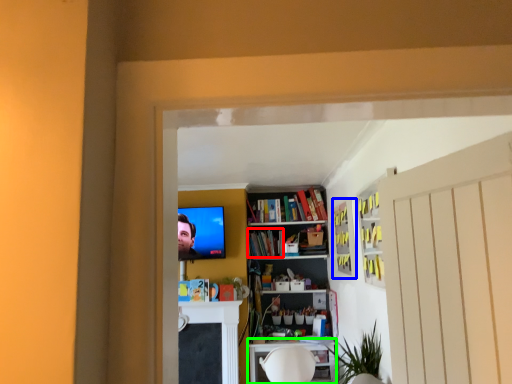
Question: Estimate the real-world distances between objects in this image. Which object is farther from book (highlighted by a red box), cabinet (highlighted by a blue box) or table (highlighted by a green box)?

Choices:
 (A) cabinet
 (B) table

Answer: (A)